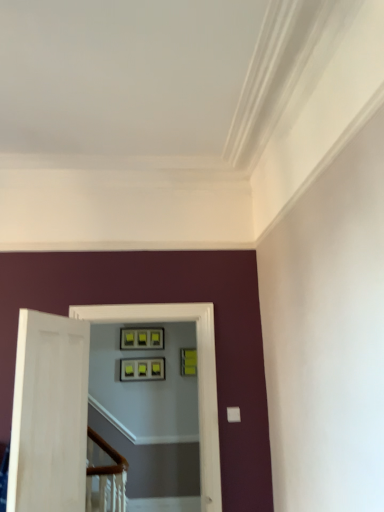
Question: Is matte black picture frame at center, which is the second picture frame from right to left, oriented towards green matte picture frame at upper center, which is the 2th picture frame from left to right?

Choices:
 (A) no
 (B) yes

Answer: (A)

Question: Is matte black picture frame at center, which is the second picture frame from right to left, bigger than green matte picture frame at upper center, which is the 2th picture frame from left to right?

Choices:
 (A) yes
 (B) no

Answer: (B)

Question: Does matte black picture frame at center, which is the second picture frame from right to left, appear on the right side of green matte picture frame at upper center, which is the 2th picture frame from left to right?

Choices:
 (A) yes
 (B) no

Answer: (B)

Question: From a real-world perspective, is matte black picture frame at center, which is the second picture frame from right to left, located higher than green matte picture frame at upper center, which is the 2th picture frame from left to right?

Choices:
 (A) no
 (B) yes

Answer: (A)

Question: Does matte black picture frame at center, which is the 1th picture frame in left-to-right order, have a smaller size compared to green matte picture frame at upper center, which is the 2th picture frame from left to right?

Choices:
 (A) no
 (B) yes

Answer: (B)

Question: From the image's perspective, relative to matte black picture frame at center, which is the 1th picture frame in left-to-right order, is matte black frames at center above or below?

Choices:
 (A) below
 (B) above

Answer: (B)

Question: Is matte black frames at center inside or outside of matte black picture frame at center, which is the 1th picture frame in left-to-right order?

Choices:
 (A) inside
 (B) outside

Answer: (B)

Question: Is matte black frames at center wider or thinner than matte black picture frame at center, which is the second picture frame from right to left?

Choices:
 (A) wide
 (B) thin

Answer: (A)

Question: Is matte black frames at center in front of or behind matte black picture frame at center, which is the 1th picture frame in left-to-right order, in the image?

Choices:
 (A) behind
 (B) front

Answer: (B)

Question: Considering the positions of matte black picture frame at center, which is the second picture frame from right to left, and green matte picture frame at upper center, the 1th picture frame positioned from the right, in the image, is matte black picture frame at center, which is the second picture frame from right to left, bigger or smaller than green matte picture frame at upper center, the 1th picture frame positioned from the right,?

Choices:
 (A) big
 (B) small

Answer: (B)

Question: Is matte black picture frame at center, which is the 1th picture frame in left-to-right order, in front of or behind green matte picture frame at upper center, the 1th picture frame positioned from the right, in the image?

Choices:
 (A) behind
 (B) front

Answer: (B)

Question: Do you think matte black picture frame at center, which is the 1th picture frame in left-to-right order, is within green matte picture frame at upper center, the 1th picture frame positioned from the right, or outside of it?

Choices:
 (A) outside
 (B) inside

Answer: (A)

Question: Considering the positions of point (132, 361) and point (190, 359), is point (132, 361) closer or farther from the camera than point (190, 359)?

Choices:
 (A) farther
 (B) closer

Answer: (B)

Question: Is matte black frames at center in front of or behind green matte picture frame at upper center, the 1th picture frame positioned from the right, in the image?

Choices:
 (A) front
 (B) behind

Answer: (A)

Question: Looking at their shapes, would you say matte black frames at center is wider or thinner than green matte picture frame at upper center, the 1th picture frame positioned from the right?

Choices:
 (A) thin
 (B) wide

Answer: (B)